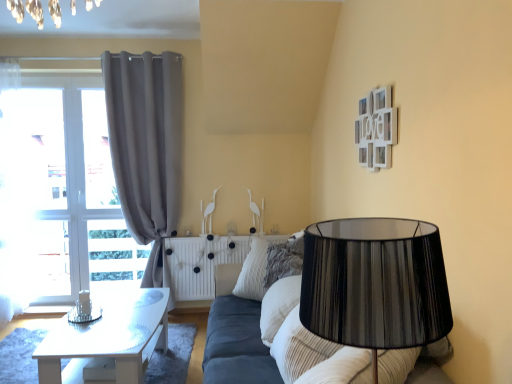
Where is `blank space above white textured radiator at center (from a real-world perspective)`? This screenshot has width=512, height=384. blank space above white textured radiator at center (from a real-world perspective) is located at coordinates (239, 235).